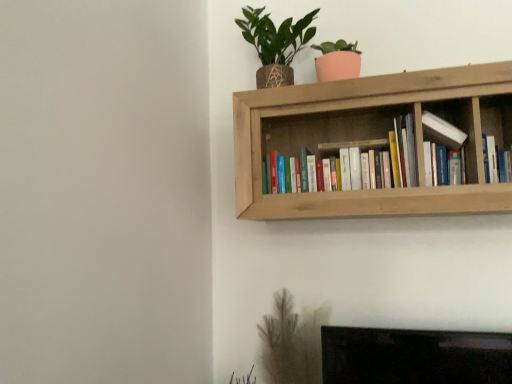
Question: Is hardcover books at center, the 1th book viewed from the left, wider or thinner than natural wood bookshelf at upper center?

Choices:
 (A) thin
 (B) wide

Answer: (A)

Question: Considering the positions of hardcover books at center, the 1th book viewed from the left, and natural wood bookshelf at upper center in the image, is hardcover books at center, the 1th book viewed from the left, taller or shorter than natural wood bookshelf at upper center?

Choices:
 (A) short
 (B) tall

Answer: (A)

Question: Estimate the real-world distances between objects in this image. Which object is farther from the hardcover books at center, the 1th book viewed from the left?

Choices:
 (A) green leafy plant in woven pot at upper right
 (B) white glossy bookshelf at upper right
 (C) hardcover book at upper right, which is counted as the 1th book, starting from the right
 (D) natural wood bookshelf at upper center

Answer: (C)

Question: Estimate the real-world distances between objects in this image. Which object is farther from the natural wood bookshelf at upper center?

Choices:
 (A) green leafy plant in woven pot at upper right
 (B) hardcover book at upper right, positioned as the 2th book in left-to-right order
 (C) hardcover books at center, arranged as the second book when viewed from the right
 (D) white glossy bookshelf at upper right

Answer: (B)